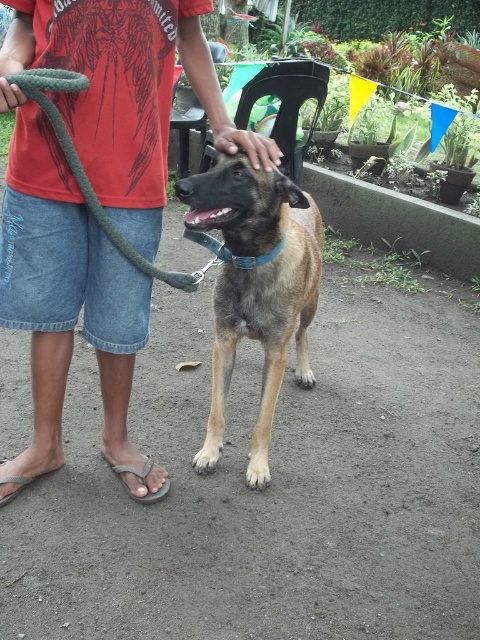
Consider the image. Does denim shorts at lower left appear on the right side of gray rubber sandal at lower left?

Correct, you'll find denim shorts at lower left to the right of gray rubber sandal at lower left.

Does denim shorts at lower left have a lesser width compared to gray rubber sandal at lower left?

Incorrect, denim shorts at lower left's width is not less than gray rubber sandal at lower left's.

Where is `denim shorts at lower left`? The width and height of the screenshot is (480, 640). denim shorts at lower left is located at coordinates (96, 193).

Is the position of denim shorts at lower left less distant than that of gray fabric sandal at lower left?

That is True.

Can you confirm if denim shorts at lower left is positioned to the right of gray fabric sandal at lower left?

Yes, denim shorts at lower left is to the right of gray fabric sandal at lower left.

Where is `denim shorts at lower left`? denim shorts at lower left is located at coordinates (96, 193).

Looking at this image, is green rope leash at left shorter than gray fabric sandal at lower left?

In fact, green rope leash at left may be taller than gray fabric sandal at lower left.

Is green rope leash at left further to camera compared to gray fabric sandal at lower left?

No, it is not.

Is point (35, 90) farther from viewer compared to point (3, 460)?

That is False.

In order to click on green rope leash at left in this screenshot , I will do point(90,182).